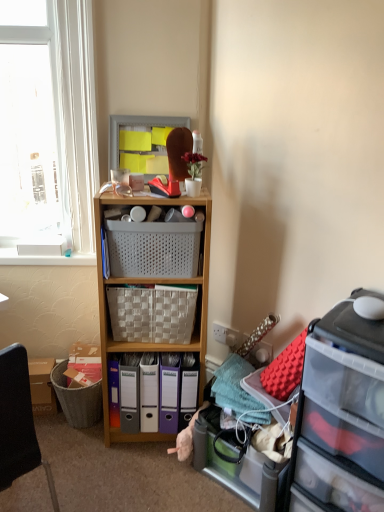
Identify the location of free space above gray textured trash bin at lower left (from a real-world perspective). This screenshot has width=384, height=512. (72, 368).